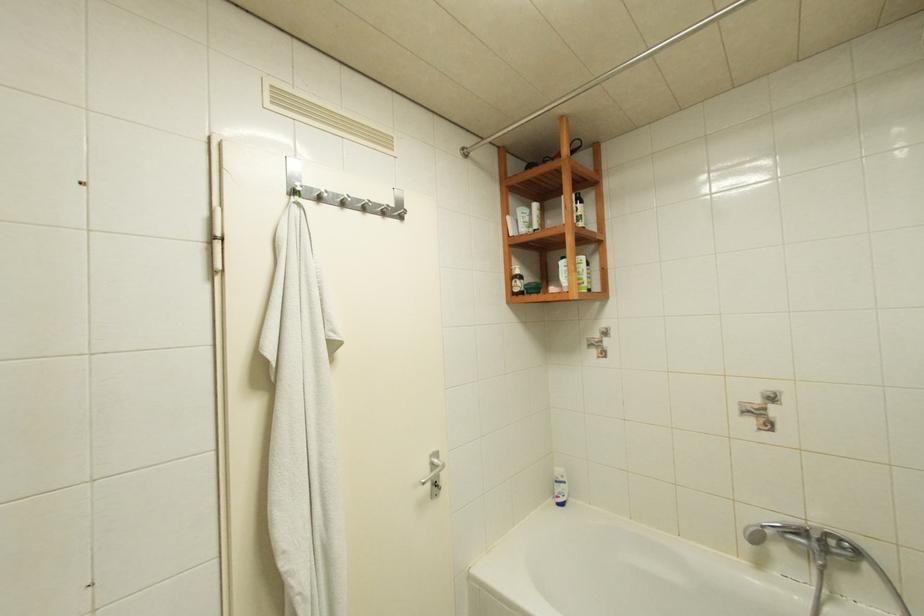
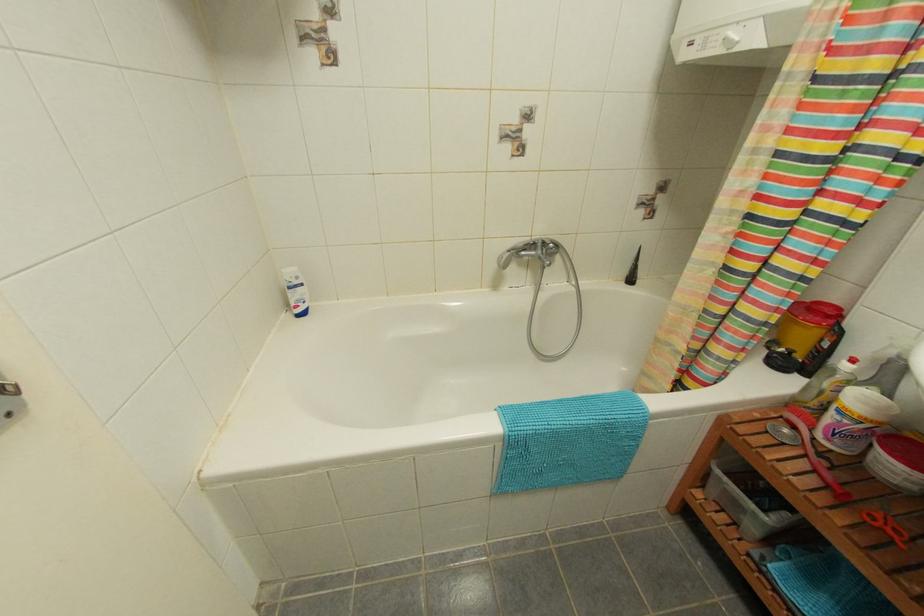
The images are taken continuously from a first-person perspective. In which direction is your viewpoint rotating?

The camera rotated toward right-down.